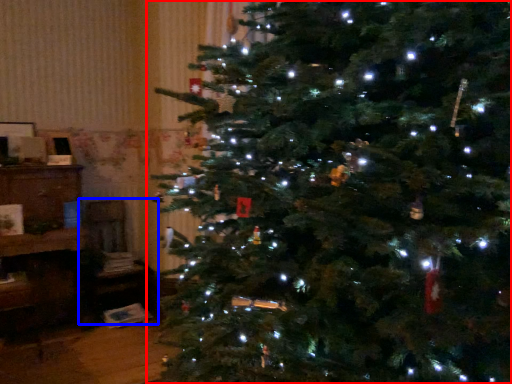
Question: Among these objects, which one is farthest to the camera, christmas tree (highlighted by a red box) or chair (highlighted by a blue box)?

Choices:
 (A) christmas tree
 (B) chair

Answer: (B)